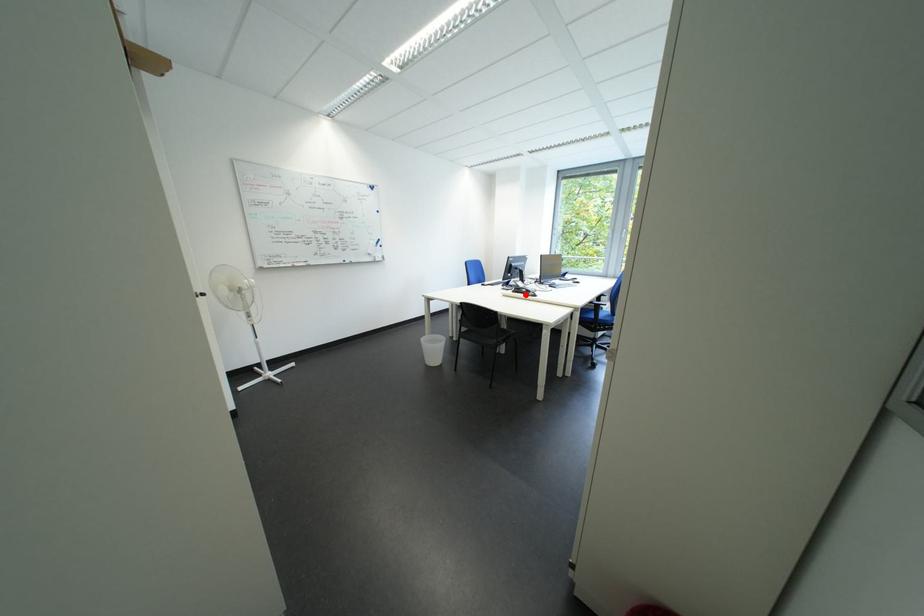
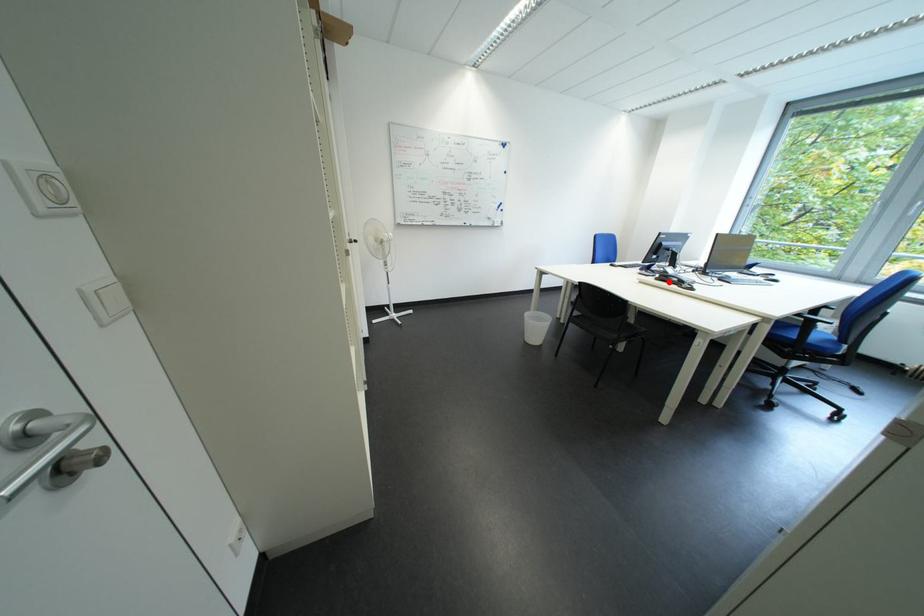
I am providing you with two images of the same scene from different viewpoints. A red point is marked on the first image and another point is marked on the second image. Does the point marked in image1 correspond to the same location as the one in image2?

Yes